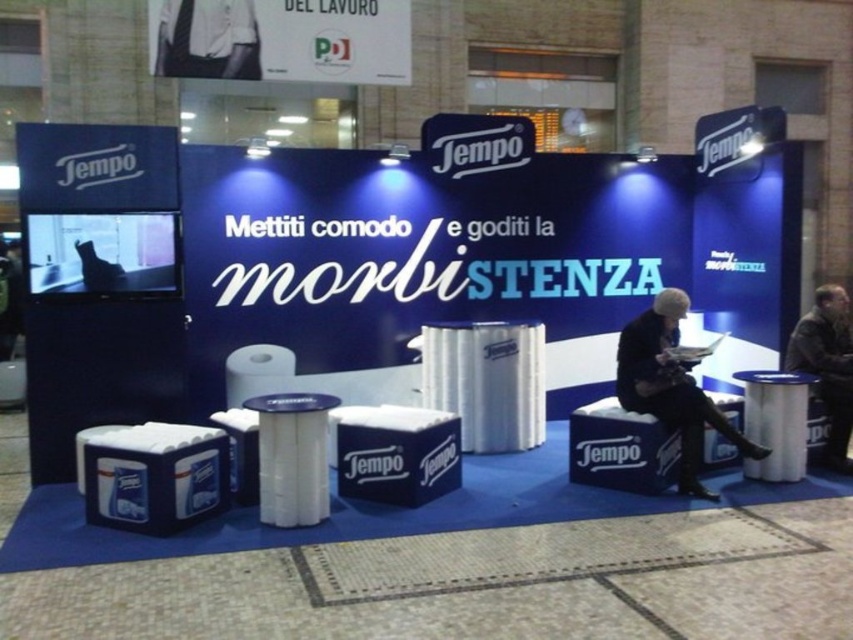
Question: Which point is closer to the camera?

Choices:
 (A) (788, 416)
 (B) (195, 54)
 (C) (657, 349)

Answer: (C)

Question: Is white shirt at upper left above dark brown leather jacket at lower right?

Choices:
 (A) no
 (B) yes

Answer: (B)

Question: Where is black fabric jacket at lower right located in relation to white shirt at upper left in the image?

Choices:
 (A) below
 (B) above

Answer: (A)

Question: Does dark brown leather jacket at lower right have a lesser width compared to white plastic stool at lower right?

Choices:
 (A) yes
 (B) no

Answer: (B)

Question: Which of these objects is positioned closest to the black fabric jacket at lower right?

Choices:
 (A) dark brown leather jacket at lower right
 (B) white plastic stool at lower right

Answer: (B)

Question: Which point is farther from the camera taking this photo?

Choices:
 (A) (698, 422)
 (B) (759, 465)
 (C) (256, 32)
 (D) (799, 352)

Answer: (C)